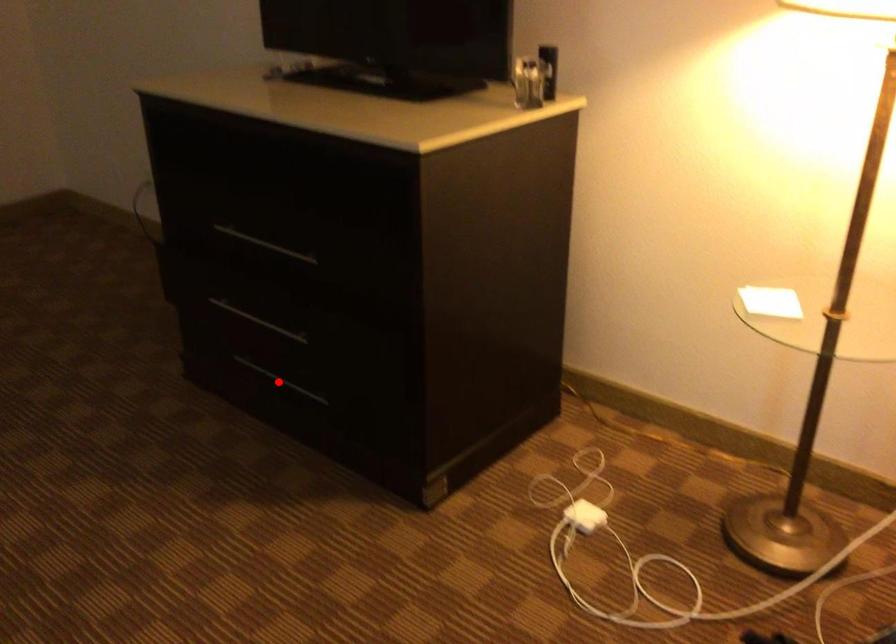
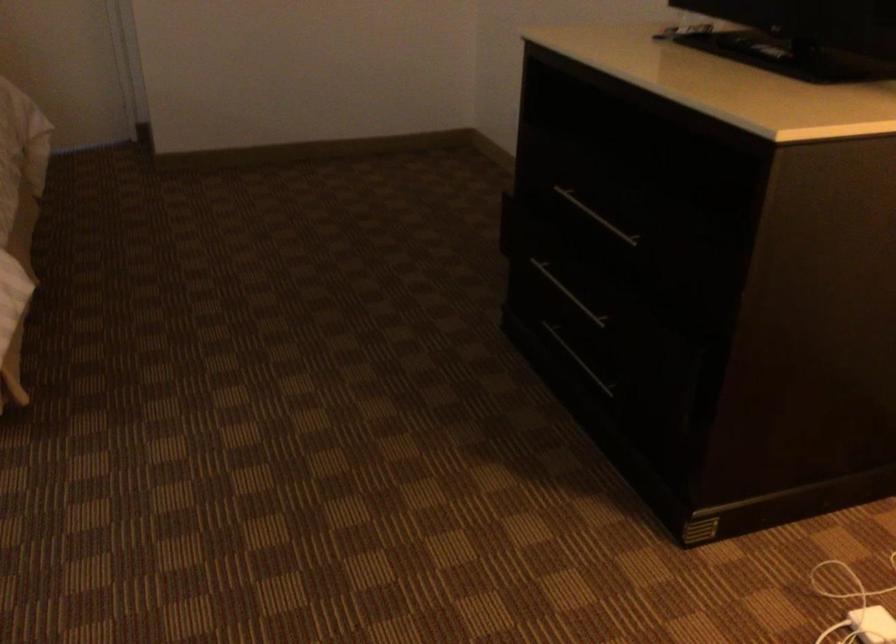
Find the pixel in the second image that matches the highlighted location in the first image.

(579, 360)